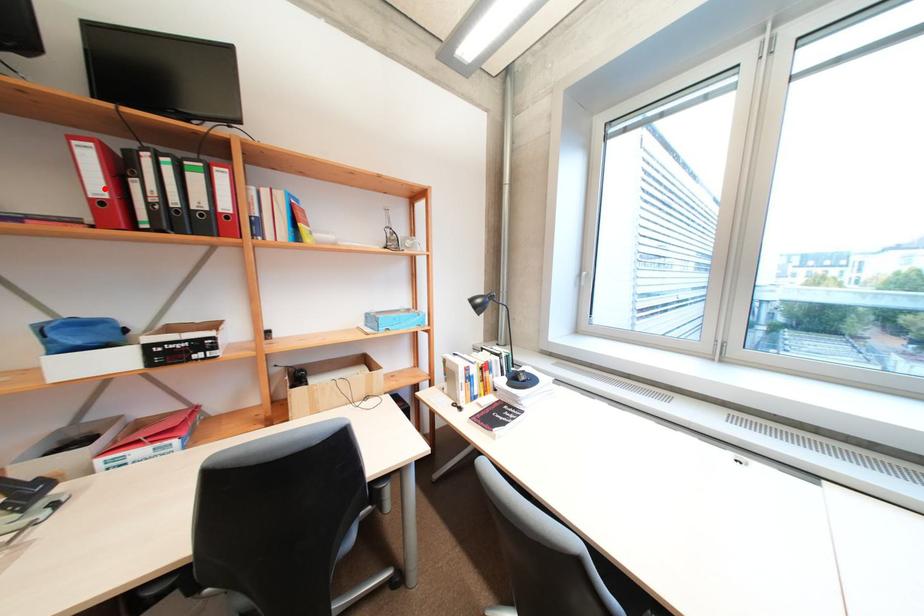
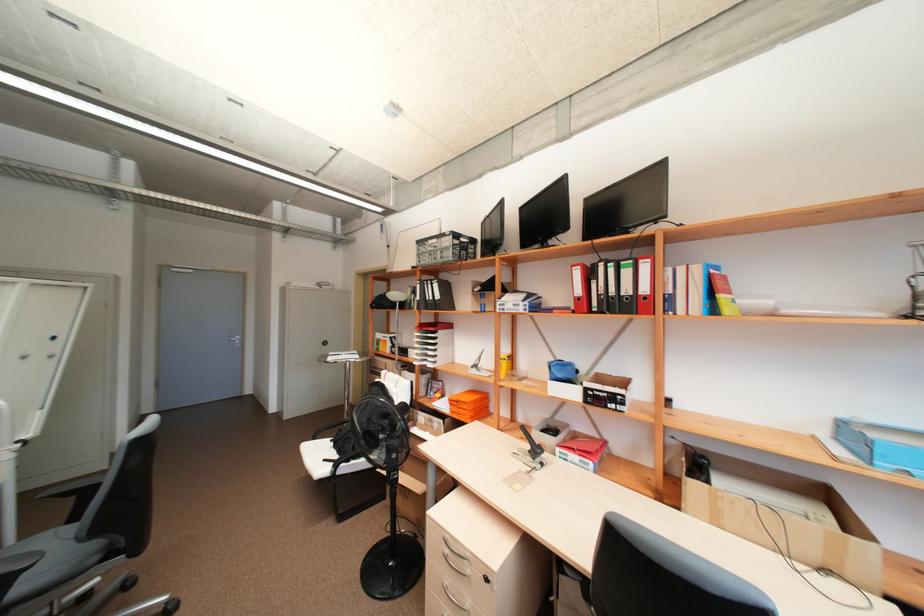
Question: I am providing you with two images of the same scene from different viewpoints. In image1, a red point is highlighted. Considering the same 3D point in image2, which of the following is correct?

Choices:
 (A) It is closer
 (B) It is farther

Answer: (A)